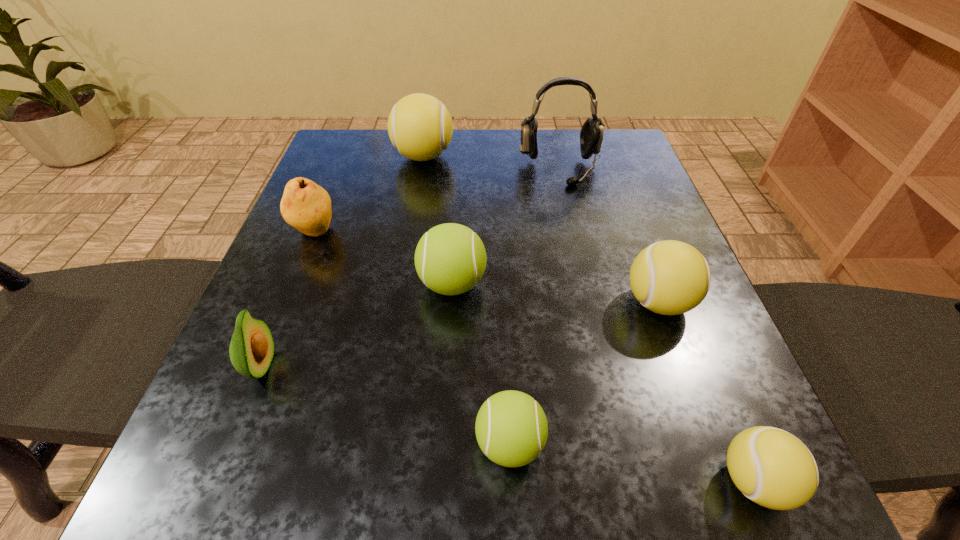
The height and width of the screenshot is (540, 960). I want to click on pear at the left edge, so click(x=306, y=206).

Identify the location of avocado situated at the left edge. click(x=251, y=350).

At what (x,y) coordinates should I click in order to perform the action: click on headset located at the right edge. Please return your answer as a coordinate pair (x, y). Looking at the image, I should click on (591, 135).

Identify the location of object at the far right corner. Image resolution: width=960 pixels, height=540 pixels. (591, 135).

I want to click on object at the near right corner, so click(773, 468).

The height and width of the screenshot is (540, 960). In the image, there is a desktop. Identify the location of blank space at the far edge. (551, 148).

Locate an element on the screen. vacant region at the near edge is located at coordinates click(x=485, y=511).

Identify the location of vacant space at the left edge. (289, 248).

Find the location of a particular element. vacant space at the far left corner of the desktop is located at coordinates (385, 159).

In the image, there is a desktop. Where is `free space at the far right corner`? This screenshot has width=960, height=540. free space at the far right corner is located at coordinates (636, 168).